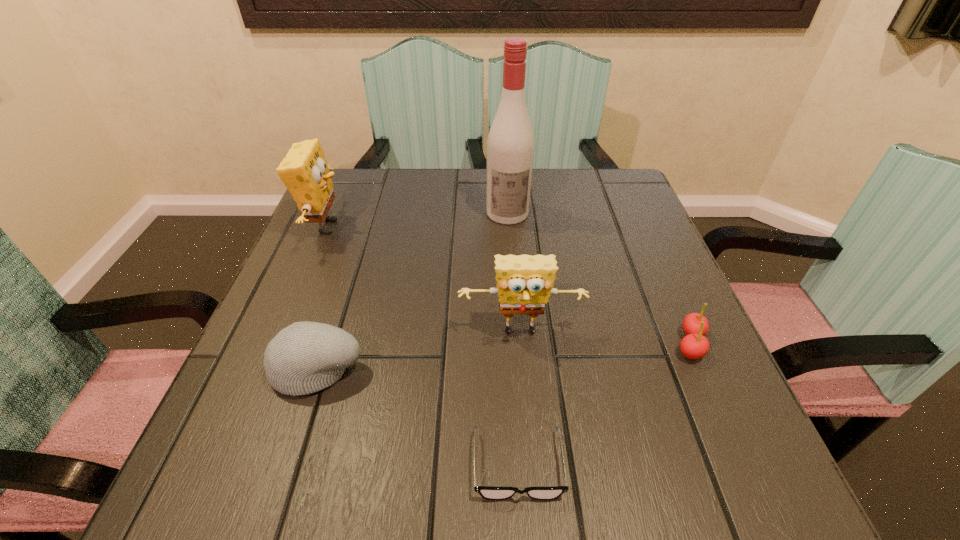
In order to click on vacant space located 0.190m on the label of the tallest object in this screenshot , I will do `click(513, 282)`.

Locate an element on the screen. vacant region located on the face of the farther sponge is located at coordinates (516, 227).

I want to click on vacant space situated on the face of the right sponge, so 526,393.

Locate an element on the screen. free space located 0.390m on the right of the beanie is located at coordinates (597, 367).

I want to click on vacant space located 0.070m on the back of the cherry, so pos(669,297).

Where is `alcohol present at the far edge`? The width and height of the screenshot is (960, 540). alcohol present at the far edge is located at coordinates (510, 145).

Identify the location of sponge positioned at the far edge. (304, 170).

What are the coordinates of `object located at the near edge` in the screenshot? It's located at (490, 493).

The width and height of the screenshot is (960, 540). In order to click on sponge present at the left edge in this screenshot , I will do `click(304, 170)`.

Image resolution: width=960 pixels, height=540 pixels. In order to click on beanie that is at the left edge in this screenshot , I will do `click(305, 357)`.